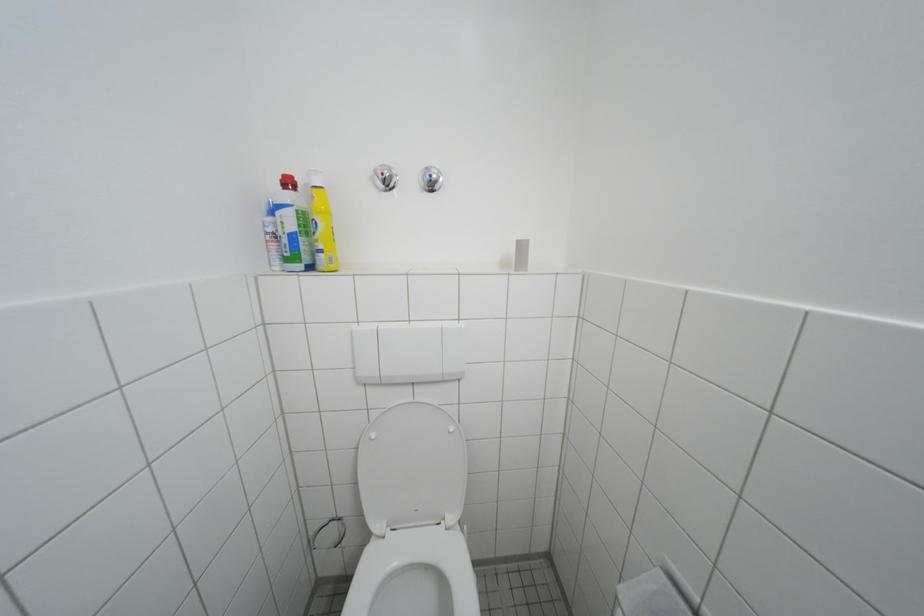
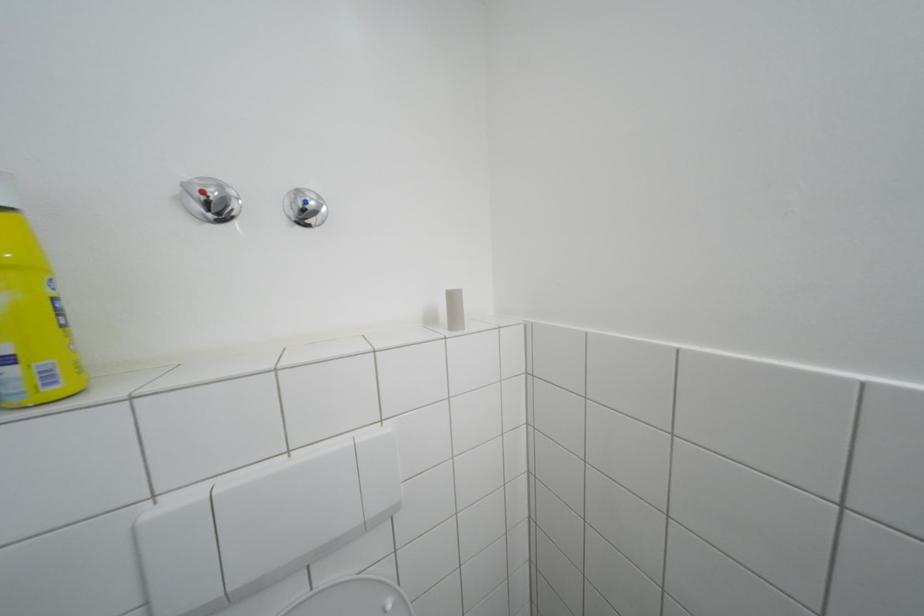
Question: The camera is either moving clockwise (left) or counter-clockwise (right) around the object. The first image is from the beginning of the video and the second image is from the end. Is the camera moving left or right when shooting the video?

Choices:
 (A) Left
 (B) Right

Answer: (A)